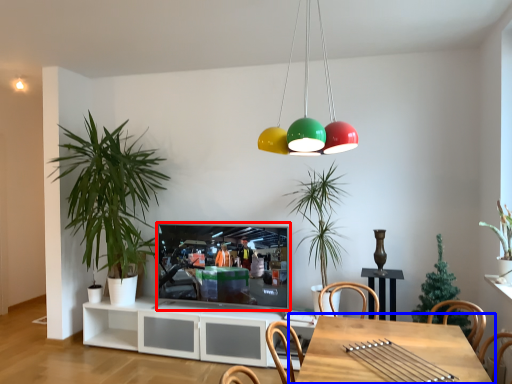
Question: Which of the following is the farthest to the observer, television (highlighted by a red box) or table (highlighted by a blue box)?

Choices:
 (A) television
 (B) table

Answer: (A)